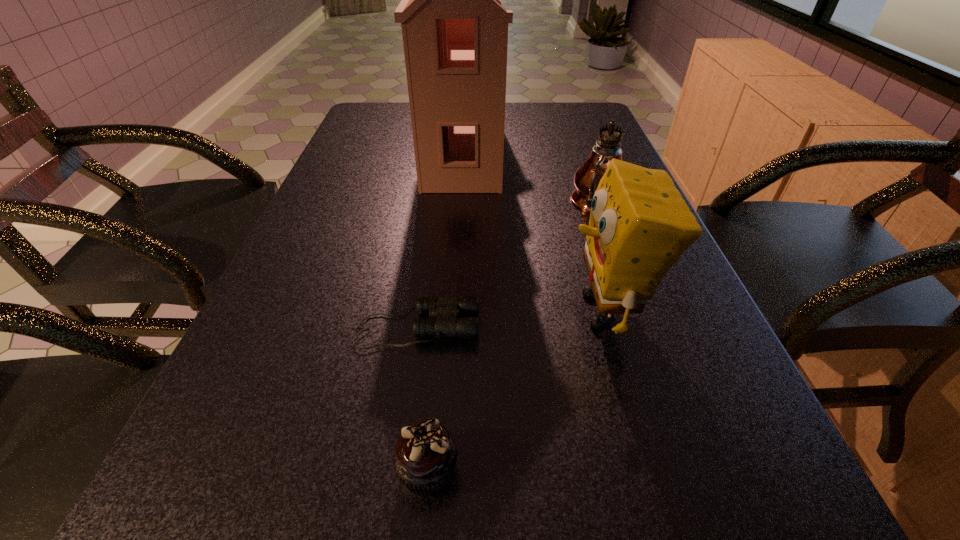
The image size is (960, 540). Identify the location of blank space that satisfies the following two spatial constraints: 1. at the eyepiece of the nearest object; 2. on the right side of the shortest object. (397, 470).

Where is `vacant space that satisfies the following two spatial constraints: 1. on the front-facing side of the dollhouse; 2. on the left side of the oil lamp`? vacant space that satisfies the following two spatial constraints: 1. on the front-facing side of the dollhouse; 2. on the left side of the oil lamp is located at coordinates (459, 204).